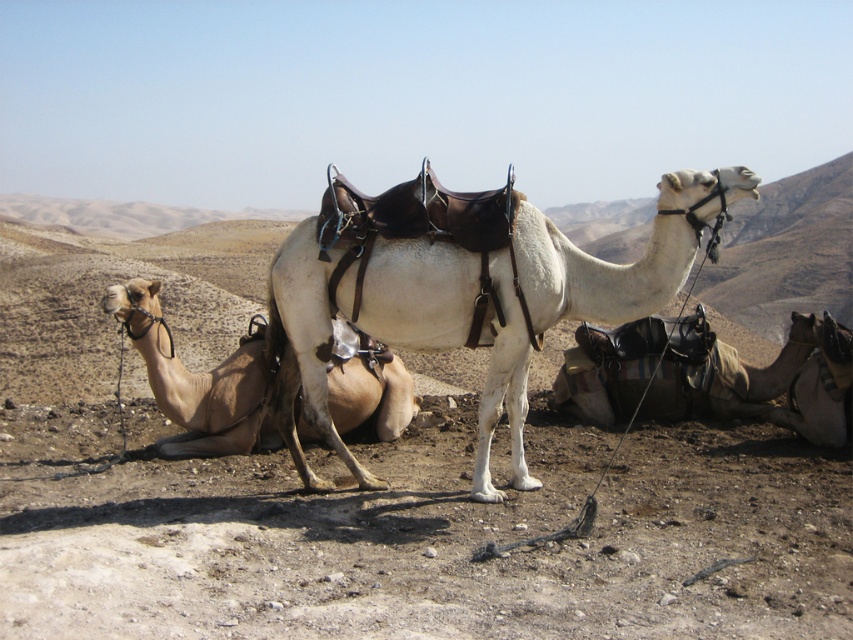
Question: Which point is closer to the camera?

Choices:
 (A) (154, 323)
 (B) (418, 278)

Answer: (B)

Question: Is dusty brown ground at center to the left of white leather saddle at center from the viewer's perspective?

Choices:
 (A) yes
 (B) no

Answer: (A)

Question: Can you confirm if dusty brown ground at center is positioned above light brown leather camel at center?

Choices:
 (A) yes
 (B) no

Answer: (A)

Question: Among these objects, which one is farthest from the camera?

Choices:
 (A) brown leather saddle at lower right
 (B) light brown leather camel at center
 (C) white leather saddle at center

Answer: (A)

Question: Based on their relative distances, which object is farther from the light brown leather camel at center?

Choices:
 (A) dusty brown ground at center
 (B) white leather saddle at center

Answer: (A)

Question: Can you confirm if light brown leather camel at center is smaller than brown leather saddle at lower right?

Choices:
 (A) no
 (B) yes

Answer: (A)